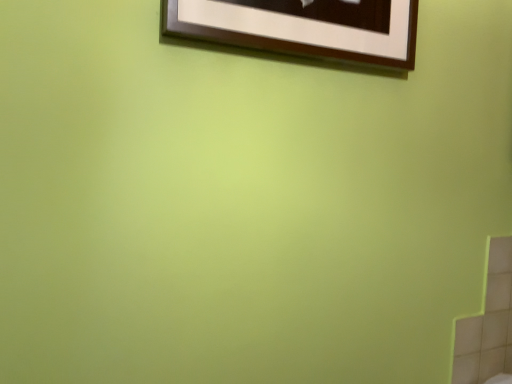
What do you see at coordinates (304, 28) in the screenshot? This screenshot has height=384, width=512. I see `brown wooden picture frame at upper center` at bounding box center [304, 28].

Identify the location of brown wooden picture frame at upper center. This screenshot has width=512, height=384. (304, 28).

Identify the location of brown wooden picture frame at upper center. (304, 28).